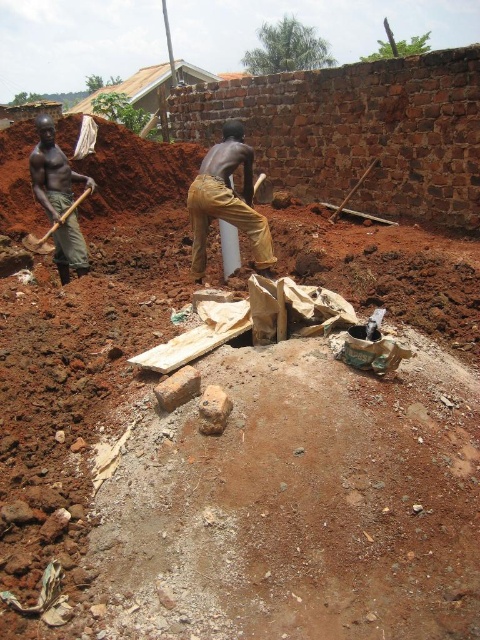
You are a safety inspector at the construction site. You notice two items in the image that need immediate attention. The brown cotton pants at center and the dark skin shovel at left. Based on their sizes, which item is more likely to be a hazard if left unattended? Please explain your reasoning.

The dark skin shovel at left is larger in size compared to the brown cotton pants at center, making it a bigger potential hazard if left unattended due to its size and weight.

You are a safety inspector checking the construction site. You notice the brown cotton pants at center and the wooden handle shovel at left. Which item is taking up more space on the ground?

The wooden handle shovel at left occupies more space than the brown cotton pants at center, so the shovel is taking up more space on the ground.

You are a construction inspector reviewing the site layout. You notice a point marked at coordinates (x=227, y=200). Based on the scene description, what object is this point located on?

The point at coordinates (x=227, y=200) is located on the brown cotton pants at center.